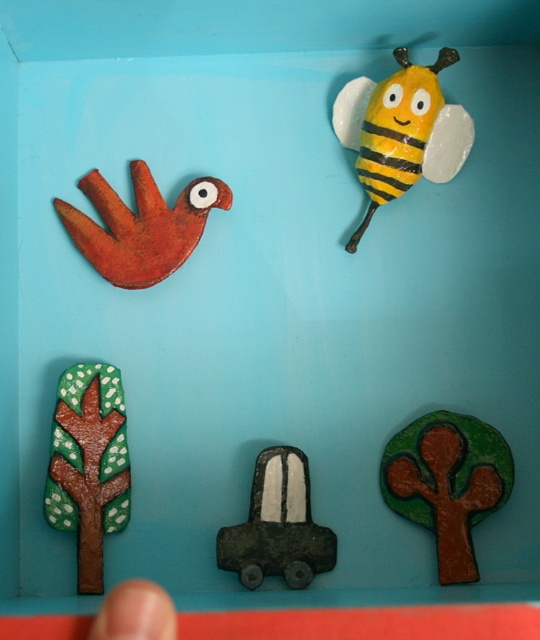
You are an artist planning to paint a new design on the brown matte tree at lower left and the matte orange bird at upper left. Which object requires a smaller amount of paint due to its size?

The brown matte tree at lower left requires a smaller amount of paint because its width is less than the matte orange bird at upper left.

You are standing in front of the image and see two points marked at coordinates point (470, 456) and point (71, 240). Which point is closer to you?

Point (470, 456) is in front of point (71, 240), so it is closer to you.

You are an artist looking to paint a new scene. You want to place a new element behind the brown matte tree at lower left so it partially hides the matte orange bird at upper left. Is this possible given their current positions?

The brown matte tree at lower left is in front of the matte orange bird at upper left, so placing a new element behind the brown matte tree at lower left would not hide the matte orange bird at upper left since the tree is already in front of it.